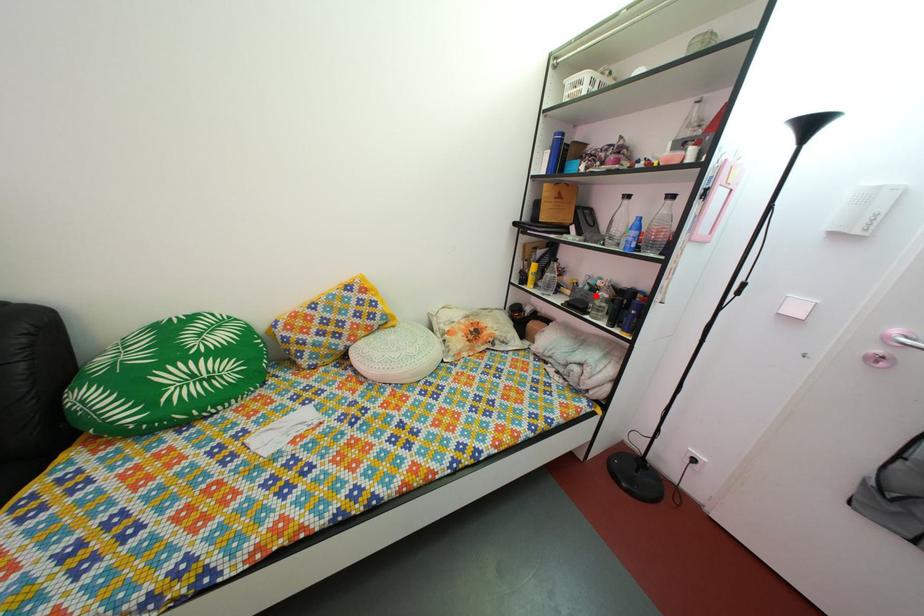
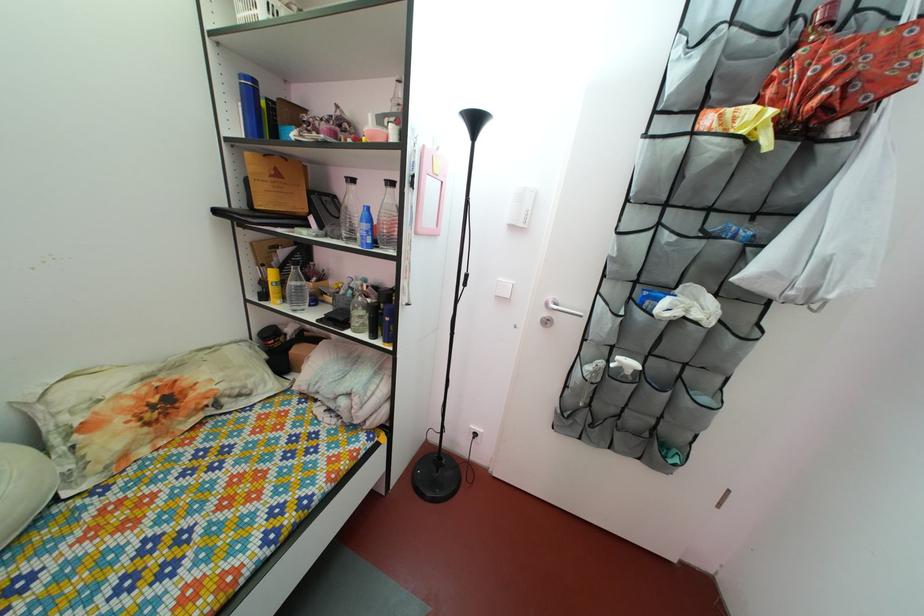
Question: A red point is marked in image1. In image2, is the corresponding 3D point closer to the camera or farther? Reply with the corresponding letter.

Choices:
 (A) The corresponding 3D point is closer.
 (B) The corresponding 3D point is farther.

Answer: (B)